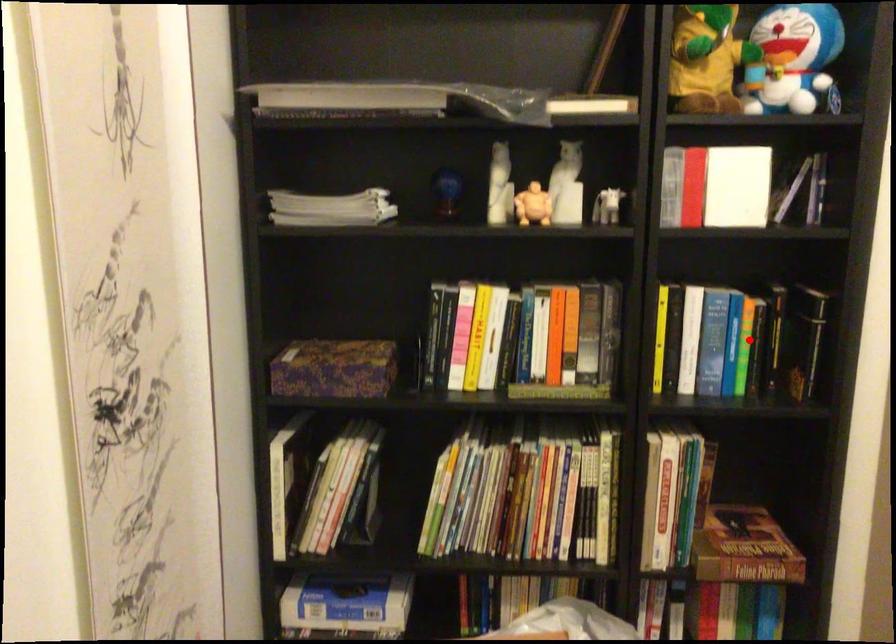
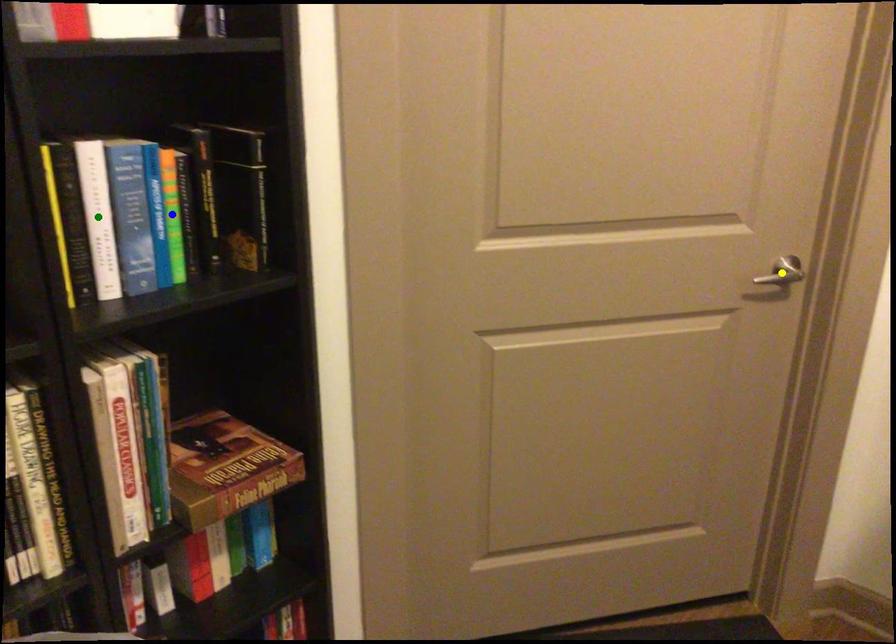
Question: I am providing you with two images of the same scene from different viewpoints. A red point is marked on the first image. You are given multiple points on the second image. Which spot in image 2 lines up with the point in image 1?

Choices:
 (A) blue point
 (B) green point
 (C) yellow point

Answer: (A)